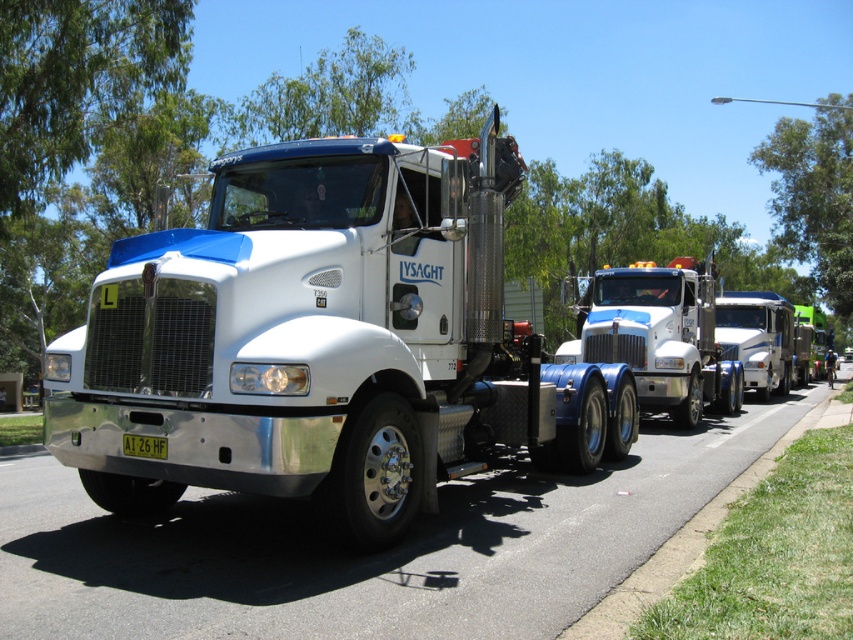
You are a photographer wanting to capture both the white metallic truck at center and the white glossy trailer truck at center in a single frame. Which truck should you position closer to the camera to ensure both are fully visible without cropping?

To ensure both the white metallic truck at center and the white glossy trailer truck at center are fully visible, position the white metallic truck at center closer to the camera since it is thinner than the trailer truck.

You are standing at the starting point of the road and want to reach the white metallic truck at center. According to the coordinates provided, in which direction should you move relative to the truck?

The white metallic truck at center is located at coordinates point (323,342), so you should move towards the center of the image to reach it.

Consider the image. You are standing at the starting point and want to reach the destination point. The path goes through the convoy of trucks on the road. Which point should you aim for first, point (49,436) or point (773,321)?

You should aim for point (49,436) first because it is in front of point (773,321) along the path.